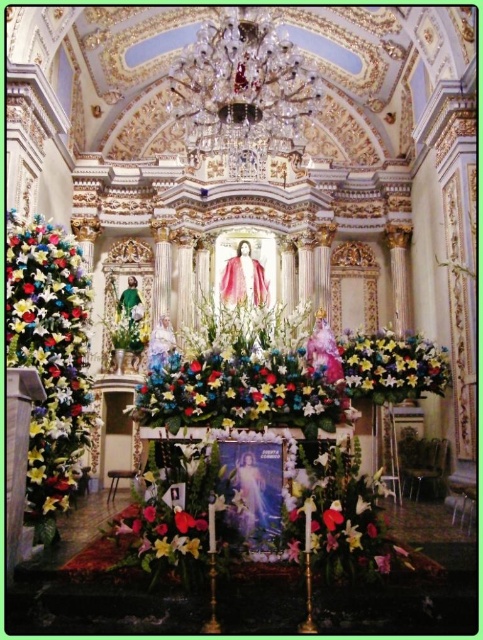
Does point (308, 410) lie in front of point (381, 400)?

Yes, point (308, 410) is in front of point (381, 400).

Is floral arrangement at center positioned in front of floral bouquet at right?

Yes, it is in front of floral bouquet at right.

Identify the location of floral arrangement at center. [239, 394].

Between floral bouquet at left and floral bouquet at right, which one is positioned higher?

floral bouquet at left is above.

Is floral bouquet at left smaller than floral bouquet at right?

Incorrect, floral bouquet at left is not smaller in size than floral bouquet at right.

What are the coordinates of `floral bouquet at left` in the screenshot? It's located at (50, 353).

Is floral bouquet at left positioned before floral arrangement at center?

Yes, it is in front of floral arrangement at center.

Between floral bouquet at left and floral arrangement at center, which one is positioned lower?

floral arrangement at center

Where is `floral bouquet at left`? The width and height of the screenshot is (483, 640). floral bouquet at left is located at coordinates (50, 353).

I want to click on floral bouquet at left, so click(50, 353).